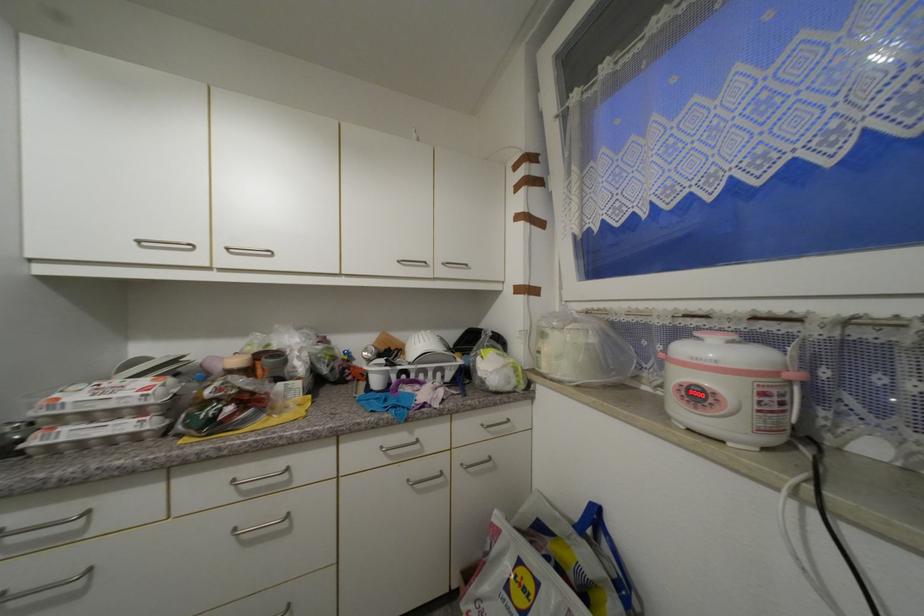
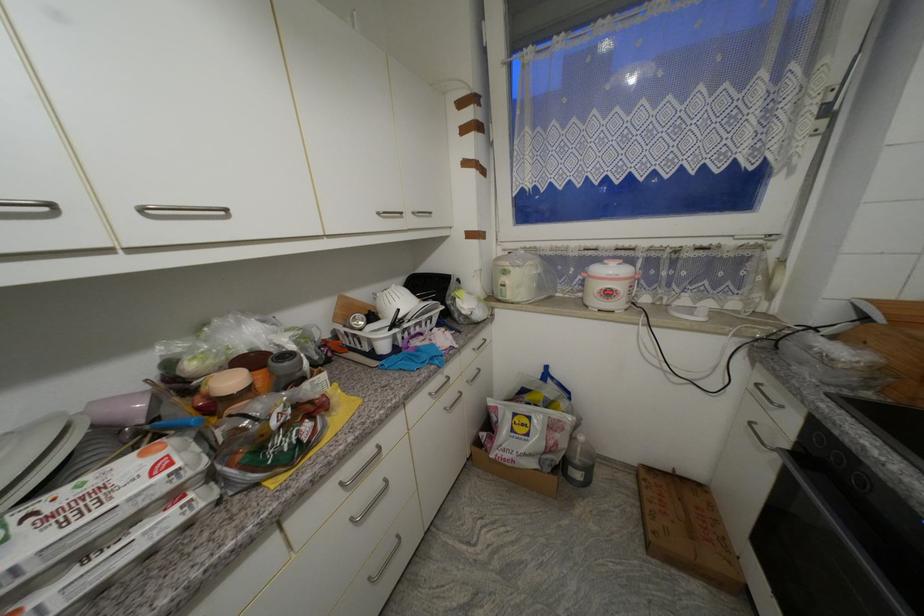
Find the pixel in the second image that matches (x=549, y=336) in the first image.

(511, 274)